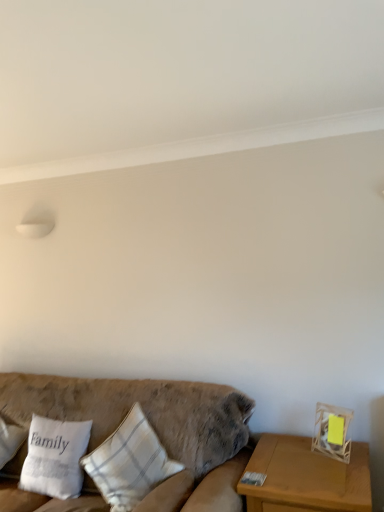
The height and width of the screenshot is (512, 384). What do you see at coordinates (129, 462) in the screenshot? I see `white cotton pillow at left, the third pillow viewed from the left` at bounding box center [129, 462].

At what (x,y) coordinates should I click in order to perform the action: click on velvet beige couch at lower left. Please return your answer as a coordinate pair (x, y). The width and height of the screenshot is (384, 512). Looking at the image, I should click on (151, 424).

Describe the element at coordinates (151, 424) in the screenshot. This screenshot has width=384, height=512. I see `velvet beige couch at lower left` at that location.

What is the approximate width of wooden table at right?

wooden table at right is 22.78 inches in width.

How much space does white fabric pillow at lower left, placed as the 2th pillow when sorted from left to right, occupy horizontally?

It is 9.31 inches.

At what (x,y) coordinates should I click in order to perform the action: click on white cotton pillow at left, which ranks as the 1th pillow in right-to-left order. Please return your answer as a coordinate pair (x, y). This screenshot has width=384, height=512. Looking at the image, I should click on (129, 462).

Is white cotton pillow at left, the third pillow viewed from the left, turned away from white fabric pillow at lower left, the second pillow when ordered from right to left?

No, white cotton pillow at left, the third pillow viewed from the left,'s orientation is not away from white fabric pillow at lower left, the second pillow when ordered from right to left.

Is white cotton pillow at left, the third pillow viewed from the left, wider or thinner than white fabric pillow at lower left, the second pillow when ordered from right to left?

In the image, white cotton pillow at left, the third pillow viewed from the left, appears to be wider than white fabric pillow at lower left, the second pillow when ordered from right to left.

From the image's perspective, which object appears higher, white cotton pillow at left, which ranks as the 1th pillow in right-to-left order, or white fabric pillow at lower left, placed as the 2th pillow when sorted from left to right?

white cotton pillow at left, which ranks as the 1th pillow in right-to-left order.

The width and height of the screenshot is (384, 512). Identify the location of the 1st pillow to the left of the white cotton pillow at left, which ranks as the 1th pillow in right-to-left order, counting from the anchor's position. (55, 457).

Consider the image. Is white cotton pillow at left, the third pillow viewed from the left, placed right next to white fabric pillow at left, positioned as the 3th pillow in right-to-left order?

They are not placed beside each other.

Do you think white cotton pillow at left, the third pillow viewed from the left, is within white fabric pillow at left, which is the 1th pillow in left-to-right order, or outside of it?

white cotton pillow at left, the third pillow viewed from the left, is not enclosed by white fabric pillow at left, which is the 1th pillow in left-to-right order.

From a real-world perspective, is white cotton pillow at left, the third pillow viewed from the left, physically located above or below white fabric pillow at left, positioned as the 3th pillow in right-to-left order?

In terms of real-world spatial position, white cotton pillow at left, the third pillow viewed from the left, is above white fabric pillow at left, positioned as the 3th pillow in right-to-left order.

Is white cotton pillow at left, the third pillow viewed from the left, facing away from white fabric pillow at left, positioned as the 3th pillow in right-to-left order?

No, white cotton pillow at left, the third pillow viewed from the left,'s orientation is not away from white fabric pillow at left, positioned as the 3th pillow in right-to-left order.

Which pillow is the 2nd one when counting from the right side of the white fabric pillow at left, positioned as the 3th pillow in right-to-left order? Please provide its 2D coordinates.

[(129, 462)]

Is white fabric pillow at left, positioned as the 3th pillow in right-to-left order, bigger than white cotton pillow at left, which ranks as the 1th pillow in right-to-left order?

No.

Based on the photo, from the image's perspective, is white fabric pillow at left, positioned as the 3th pillow in right-to-left order, on white cotton pillow at left, which ranks as the 1th pillow in right-to-left order?

Incorrect, from the image's perspective, white fabric pillow at left, positioned as the 3th pillow in right-to-left order, is lower than white cotton pillow at left, which ranks as the 1th pillow in right-to-left order.

From the image's perspective, does wooden table at right appear lower than white fabric pillow at lower left, the second pillow when ordered from right to left?

Indeed, from the image's perspective, wooden table at right is shown beneath white fabric pillow at lower left, the second pillow when ordered from right to left.

Can you tell me how much wooden table at right and white fabric pillow at lower left, the second pillow when ordered from right to left, differ in facing direction?

The angle between the facing direction of wooden table at right and the facing direction of white fabric pillow at lower left, the second pillow when ordered from right to left, is 4.51 degrees.

Consider the image. Is wooden table at right positioned far away from white fabric pillow at lower left, placed as the 2th pillow when sorted from left to right?

Yes, wooden table at right and white fabric pillow at lower left, placed as the 2th pillow when sorted from left to right, are quite far apart.

Can you confirm if wooden table at right is wider than white fabric pillow at lower left, the second pillow when ordered from right to left?

Correct, the width of wooden table at right exceeds that of white fabric pillow at lower left, the second pillow when ordered from right to left.

Does point (24, 413) appear closer or farther from the camera than point (99, 456)?

Point (24, 413) appears to be farther away from the viewer than point (99, 456).

Which is correct: velvet beige couch at lower left is inside white cotton pillow at left, the third pillow viewed from the left, or outside of it?

velvet beige couch at lower left lies outside white cotton pillow at left, the third pillow viewed from the left.

Locate an element on the screen. This screenshot has height=512, width=384. studio couch on the left of white cotton pillow at left, the third pillow viewed from the left is located at coordinates (151, 424).

From a real-world perspective, is velvet beige couch at lower left above or below white cotton pillow at left, the third pillow viewed from the left?

Clearly, from a real-world perspective, velvet beige couch at lower left is below white cotton pillow at left, the third pillow viewed from the left.

Would you consider white fabric pillow at lower left, the second pillow when ordered from right to left, to be distant from white fabric pillow at left, which is the 1th pillow in left-to-right order?

No, there isn't a large distance between white fabric pillow at lower left, the second pillow when ordered from right to left, and white fabric pillow at left, which is the 1th pillow in left-to-right order.

Between point (31, 440) and point (2, 464), which one is positioned in front?

Point (2, 464)

Looking at this image, which object is wider, white fabric pillow at lower left, placed as the 2th pillow when sorted from left to right, or white fabric pillow at left, which is the 1th pillow in left-to-right order?

Wider between the two is white fabric pillow at left, which is the 1th pillow in left-to-right order.

How distant is white fabric pillow at lower left, placed as the 2th pillow when sorted from left to right, from white fabric pillow at left, positioned as the 3th pillow in right-to-left order?

white fabric pillow at lower left, placed as the 2th pillow when sorted from left to right, and white fabric pillow at left, positioned as the 3th pillow in right-to-left order, are 25.48 centimeters apart.

Is white cotton pillow at left, the third pillow viewed from the left, next to velvet beige couch at lower left and touching it?

No.

Is white cotton pillow at left, which ranks as the 1th pillow in right-to-left order, closer to camera compared to velvet beige couch at lower left?

No, white cotton pillow at left, which ranks as the 1th pillow in right-to-left order, is further to the viewer.

The height and width of the screenshot is (512, 384). In order to click on studio couch in front of the white cotton pillow at left, the third pillow viewed from the left in this screenshot , I will do `click(151, 424)`.

Considering the sizes of white cotton pillow at left, the third pillow viewed from the left, and velvet beige couch at lower left in the image, is white cotton pillow at left, the third pillow viewed from the left, taller or shorter than velvet beige couch at lower left?

white cotton pillow at left, the third pillow viewed from the left, is shorter than velvet beige couch at lower left.

This screenshot has width=384, height=512. What are the coordinates of `the 1st pillow counting from the left side of the white cotton pillow at left, the third pillow viewed from the left` in the screenshot? It's located at (55, 457).

Locate an element on the screen. The image size is (384, 512). pillow above the white fabric pillow at left, positioned as the 3th pillow in right-to-left order (from a real-world perspective) is located at coordinates (129, 462).

When comparing their distances from white fabric pillow at lower left, placed as the 2th pillow when sorted from left to right, does wooden table at right or white fabric pillow at left, positioned as the 3th pillow in right-to-left order, seem closer?

Based on the image, white fabric pillow at left, positioned as the 3th pillow in right-to-left order, appears to be nearer to white fabric pillow at lower left, placed as the 2th pillow when sorted from left to right.

When comparing their distances from white fabric pillow at left, which is the 1th pillow in left-to-right order, does velvet beige couch at lower left or white fabric pillow at lower left, placed as the 2th pillow when sorted from left to right, seem further?

The object further to white fabric pillow at left, which is the 1th pillow in left-to-right order, is velvet beige couch at lower left.

Based on their spatial positions, is white fabric pillow at left, positioned as the 3th pillow in right-to-left order, or velvet beige couch at lower left further from wooden table at right?

The object further to wooden table at right is white fabric pillow at left, positioned as the 3th pillow in right-to-left order.

From the image, which object appears to be nearer to white cotton pillow at left, which ranks as the 1th pillow in right-to-left order, white fabric pillow at lower left, placed as the 2th pillow when sorted from left to right, or velvet beige couch at lower left?

Based on the image, velvet beige couch at lower left appears to be nearer to white cotton pillow at left, which ranks as the 1th pillow in right-to-left order.

Based on their spatial positions, is velvet beige couch at lower left or white fabric pillow at left, which is the 1th pillow in left-to-right order, closer to wooden table at right?

Based on the image, velvet beige couch at lower left appears to be nearer to wooden table at right.

Based on their spatial positions, is white fabric pillow at left, positioned as the 3th pillow in right-to-left order, or wooden table at right further from velvet beige couch at lower left?

white fabric pillow at left, positioned as the 3th pillow in right-to-left order.

Estimate the real-world distances between objects in this image. Which object is further from velvet beige couch at lower left, white fabric pillow at left, which is the 1th pillow in left-to-right order, or white fabric pillow at lower left, the second pillow when ordered from right to left?

Among the two, white fabric pillow at left, which is the 1th pillow in left-to-right order, is located further to velvet beige couch at lower left.

Based on the photo, estimate the real-world distances between objects in this image. Which object is closer to velvet beige couch at lower left, white cotton pillow at left, which ranks as the 1th pillow in right-to-left order, or white fabric pillow at lower left, the second pillow when ordered from right to left?

white cotton pillow at left, which ranks as the 1th pillow in right-to-left order, is positioned closer to the anchor velvet beige couch at lower left.

Where is `pillow between velvet beige couch at lower left and wooden table at right from left to right`? The height and width of the screenshot is (512, 384). pillow between velvet beige couch at lower left and wooden table at right from left to right is located at coordinates (129, 462).

At what (x,y) coordinates should I click in order to perform the action: click on pillow between velvet beige couch at lower left and white fabric pillow at lower left, the second pillow when ordered from right to left, along the z-axis. Please return your answer as a coordinate pair (x, y). Image resolution: width=384 pixels, height=512 pixels. Looking at the image, I should click on (129, 462).

At what (x,y) coordinates should I click in order to perform the action: click on pillow between white fabric pillow at lower left, the second pillow when ordered from right to left, and wooden table at right from left to right. Please return your answer as a coordinate pair (x, y). This screenshot has width=384, height=512. Looking at the image, I should click on coord(129,462).

Locate an element on the screen. The image size is (384, 512). studio couch between white fabric pillow at left, positioned as the 3th pillow in right-to-left order, and wooden table at right, in the horizontal direction is located at coordinates (151, 424).